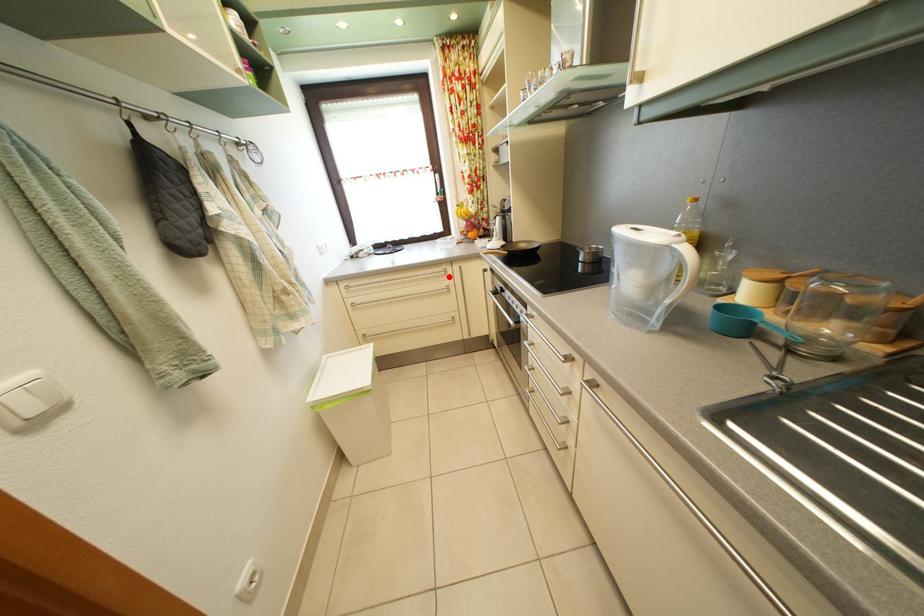
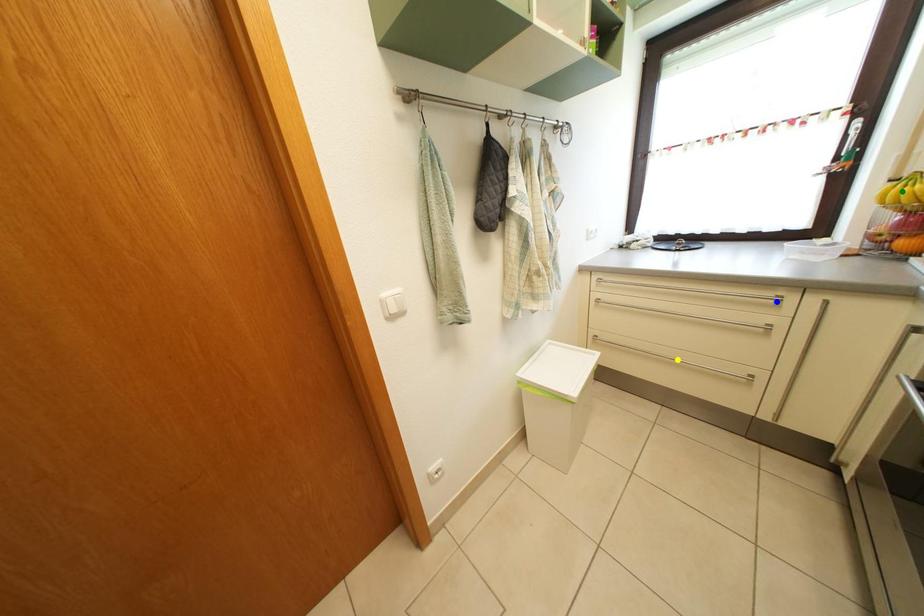
Question: I am providing you with two images of the same scene from different viewpoints. A red point is marked on the first image. You are given multiple points on the second image. Which mark in image 2 goes with the point in image 1?

Choices:
 (A) green point
 (B) blue point
 (C) yellow point

Answer: (B)